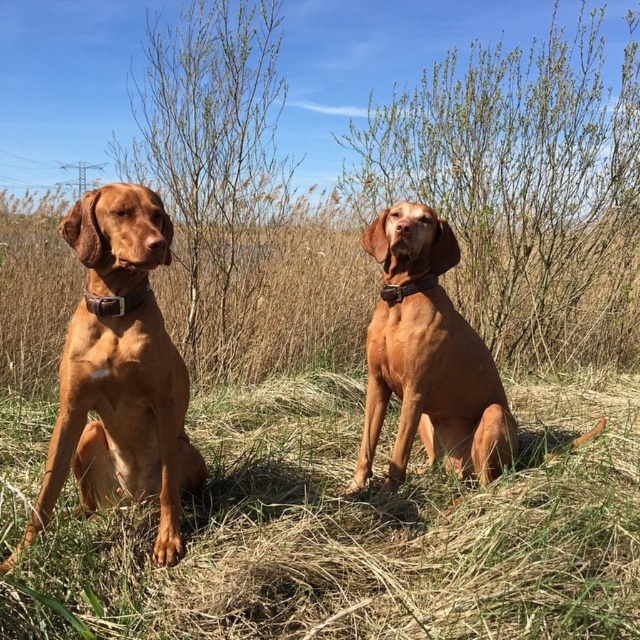
Question: Which point is closer to the camera?

Choices:
 (A) brown leather collar at center
 (B) brown leather collar at left
 (C) brown leather dog at center

Answer: (B)

Question: Is brown leather dog at center to the left of brown leather collar at center from the viewer's perspective?

Choices:
 (A) no
 (B) yes

Answer: (B)

Question: Which of the following is the closest to the observer?

Choices:
 (A) brown grass at center
 (B) brown leather dog at left
 (C) brown leather collar at left
 (D) brown leather collar at center

Answer: (A)

Question: Can you confirm if brown grass at center is positioned above brown leather collar at left?

Choices:
 (A) no
 (B) yes

Answer: (A)

Question: Considering the relative positions of brown leather dog at left and brown leather collar at left in the image provided, where is brown leather dog at left located with respect to brown leather collar at left?

Choices:
 (A) below
 (B) above

Answer: (A)

Question: Which point appears closest to the camera in this image?

Choices:
 (A) tap(145, 288)
 (B) tap(420, 285)
 (C) tap(381, 317)

Answer: (A)